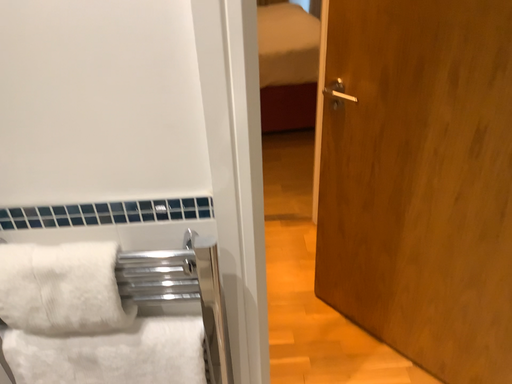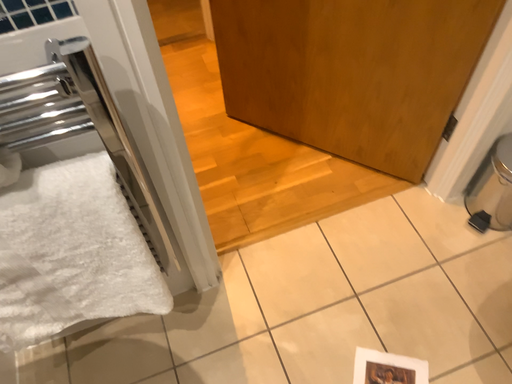
Question: Which way did the camera rotate in the video?

Choices:
 (A) rotated upward
 (B) rotated downward

Answer: (B)